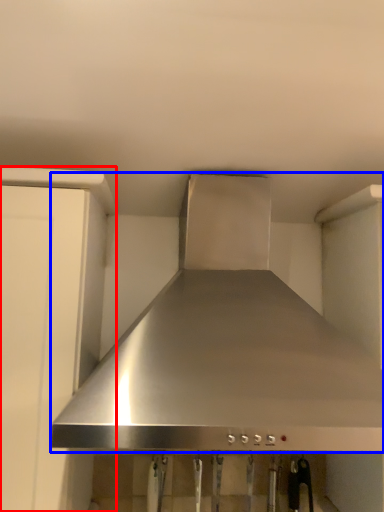
Question: Which of the following is the closest to the observer, cabinetry (highlighted by a red box) or home appliance (highlighted by a blue box)?

Choices:
 (A) cabinetry
 (B) home appliance

Answer: (B)